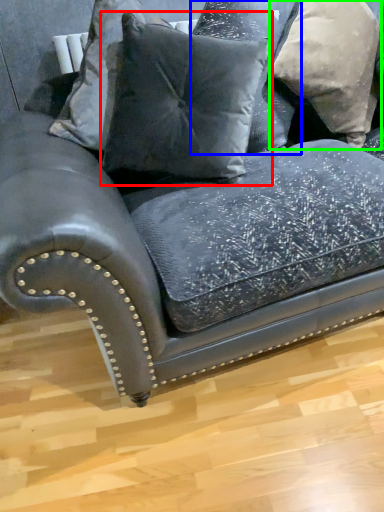
Question: Which object is the farthest from pillow (highlighted by a red box)? Choose among these: pillow (highlighted by a blue box) or pillow (highlighted by a green box).

Choices:
 (A) pillow
 (B) pillow

Answer: (B)